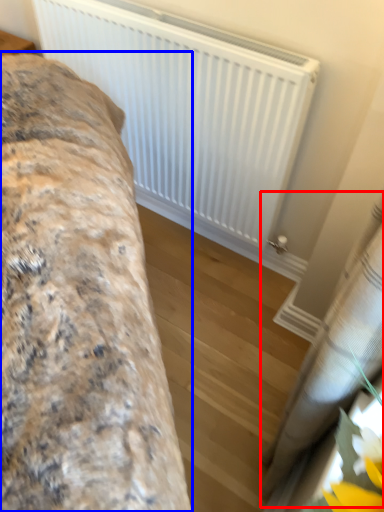
Question: Which of the following is the closest to the observer, curtain (highlighted by a red box) or furniture (highlighted by a blue box)?

Choices:
 (A) curtain
 (B) furniture

Answer: (A)